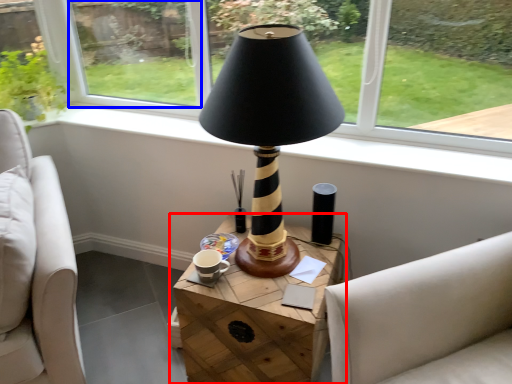
Question: Which object is closer to the camera taking this photo, table (highlighted by a red box) or window screen (highlighted by a blue box)?

Choices:
 (A) table
 (B) window screen

Answer: (A)